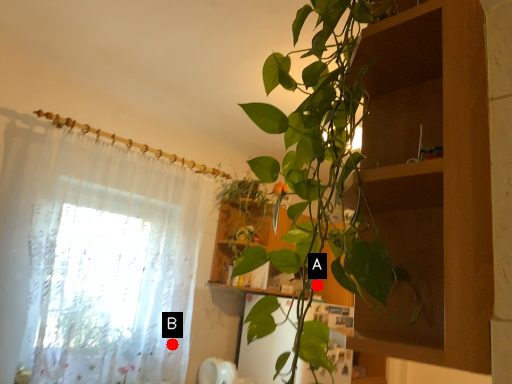
Question: Two points are circled on the image, labeled by A and B beside each circle. Which point is closer to the camera?

Choices:
 (A) A is closer
 (B) B is closer

Answer: (B)